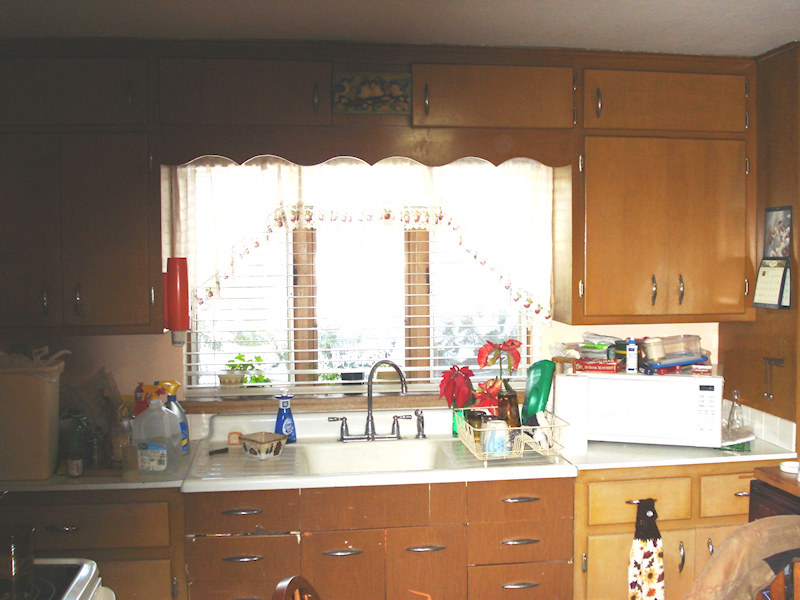
You are a GUI agent. You are given a task and a screenshot of the screen. Output one action in this format:
    pyautogui.click(x=<x>, y=<y>)
    Task: Click on the sink handles
    This screenshot has width=800, height=600.
    Given the screenshot: What is the action you would take?
    [404, 414], [336, 418]